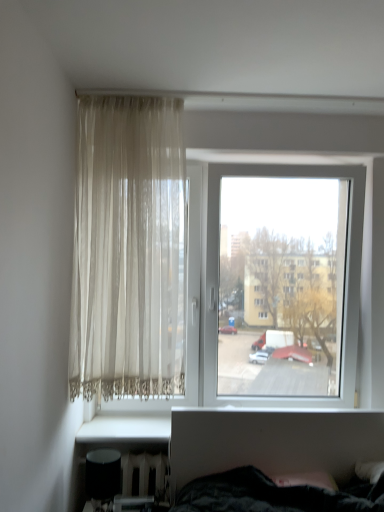
Question: Is sheer beige curtain at upper left not within transparent glass window at center?

Choices:
 (A) no
 (B) yes

Answer: (B)

Question: Is sheer beige curtain at upper left shorter than transparent glass window at center?

Choices:
 (A) no
 (B) yes

Answer: (A)

Question: Is sheer beige curtain at upper left in front of transparent glass window at center?

Choices:
 (A) no
 (B) yes

Answer: (B)

Question: Is sheer beige curtain at upper left looking in the opposite direction of transparent glass window at center?

Choices:
 (A) no
 (B) yes

Answer: (B)

Question: Can you confirm if sheer beige curtain at upper left is positioned to the left of transparent glass window at center?

Choices:
 (A) no
 (B) yes

Answer: (B)

Question: Can you confirm if sheer beige curtain at upper left is thinner than transparent glass window at center?

Choices:
 (A) yes
 (B) no

Answer: (A)

Question: Considering the relative sizes of transparent glass window at center and sheer beige curtain at upper left in the image provided, is transparent glass window at center shorter than sheer beige curtain at upper left?

Choices:
 (A) no
 (B) yes

Answer: (B)

Question: Can we say transparent glass window at center lies outside sheer beige curtain at upper left?

Choices:
 (A) yes
 (B) no

Answer: (A)

Question: Is the position of transparent glass window at center more distant than that of sheer beige curtain at upper left?

Choices:
 (A) no
 (B) yes

Answer: (B)

Question: Would you say transparent glass window at center contains sheer beige curtain at upper left?

Choices:
 (A) yes
 (B) no

Answer: (B)

Question: Is transparent glass window at center looking in the opposite direction of sheer beige curtain at upper left?

Choices:
 (A) yes
 (B) no

Answer: (A)

Question: Considering the relative sizes of transparent glass window at center and sheer beige curtain at upper left in the image provided, is transparent glass window at center bigger than sheer beige curtain at upper left?

Choices:
 (A) yes
 (B) no

Answer: (A)

Question: From a real-world perspective, is sheer beige curtain at upper left positioned above or below transparent glass window at center?

Choices:
 (A) above
 (B) below

Answer: (A)